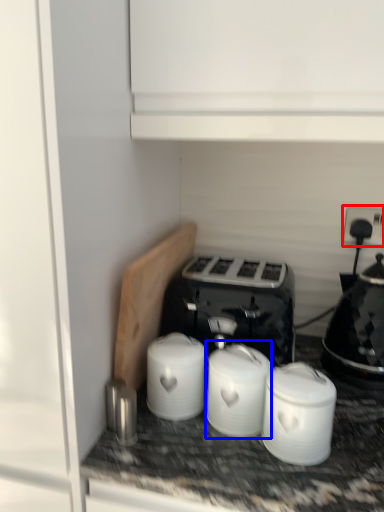
Question: Which of the following is the closest to the observer, electric outlet (highlighted by a red box) or appliance (highlighted by a blue box)?

Choices:
 (A) electric outlet
 (B) appliance

Answer: (B)